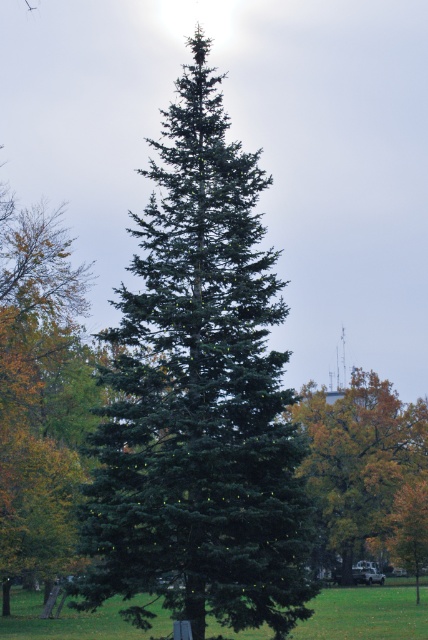
Describe the element at coordinates (365, 468) in the screenshot. The height and width of the screenshot is (640, 428). I see `golden yellow leaves at center` at that location.

Is golden yellow leaves at center bigger than green grass at center?

Incorrect, golden yellow leaves at center is not larger than green grass at center.

Which is in front, point (410, 529) or point (163, 611)?

Point (163, 611) is more forward.

This screenshot has width=428, height=640. I want to click on golden yellow leaves at center, so click(365, 468).

Can you confirm if green matte tree at center is bigger than golden yellow leaves at center?

Actually, green matte tree at center might be smaller than golden yellow leaves at center.

Between green matte tree at center and golden yellow leaves at center, which one has more height?

With more height is green matte tree at center.

Between point (146, 346) and point (401, 522), which one is positioned behind?

The point (401, 522) is behind.

The image size is (428, 640). Find the location of `green matte tree at center`. green matte tree at center is located at coordinates (199, 397).

Is green matte tree at center thinner than green grass at center?

Yes.

Does green matte tree at center have a lesser height compared to green grass at center?

In fact, green matte tree at center may be taller than green grass at center.

Which is in front, point (190, 90) or point (413, 624)?

Positioned in front is point (190, 90).

Locate an element on the screen. green matte tree at center is located at coordinates (199, 397).